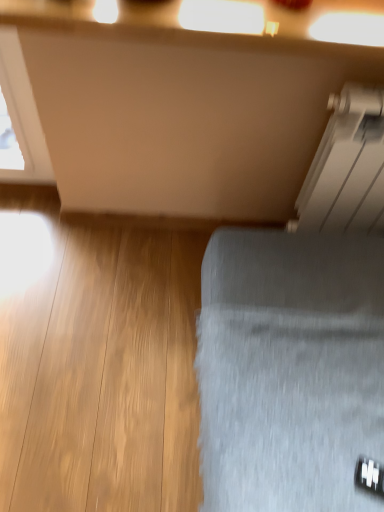
The width and height of the screenshot is (384, 512). Describe the element at coordinates (347, 167) in the screenshot. I see `white matte radiator at upper right` at that location.

What are the coordinates of `white matte radiator at upper right` in the screenshot? It's located at (347, 167).

Measure the distance between point [324,166] and camera.

3.97 feet.

This screenshot has width=384, height=512. What are the coordinates of `white matte radiator at upper right` in the screenshot? It's located at (347, 167).